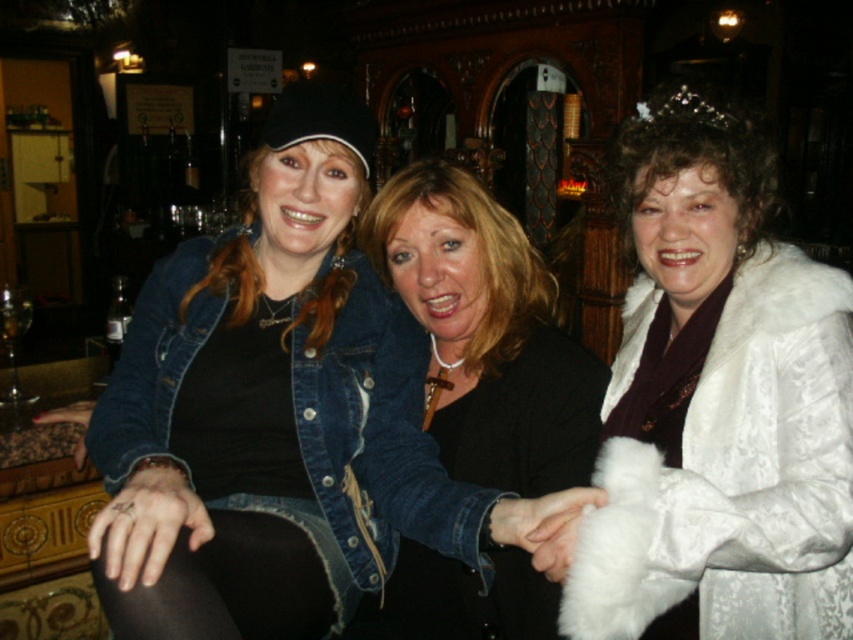
You are a photographer setting up a tripod to take a group photo of the three women. You notice the white fur coat at center and the black matte jacket at center. Which clothing item should you adjust to ensure all subjects are visible in the frame?

The white fur coat at center is taller than the black matte jacket at center, so you should lower the tripod height to accommodate the taller white fur coat at center, ensuring all subjects are visible.

You are a photographer trying to capture a group shot of the white fur coat at center and the black matte jacket at center. The camera you are using has a minimum focus distance of 12 inches. Will you need to adjust your position to ensure both subjects are in focus?

The distance between the white fur coat at center and the black matte jacket at center is 14.65 inches. Since the camera requires a minimum focus distance of 12 inches, you are within the required range. Therefore, you do not need to adjust your position to ensure both subjects are in focus.

You are taking a photo of the three women in the bar scene. You notice two points in the image at coordinates point (438, 484) and point (741, 170). Which point is closer to the camera?

Point (438, 484) is further to the camera than point (741, 170), so the closer point to the camera is point (741, 170).